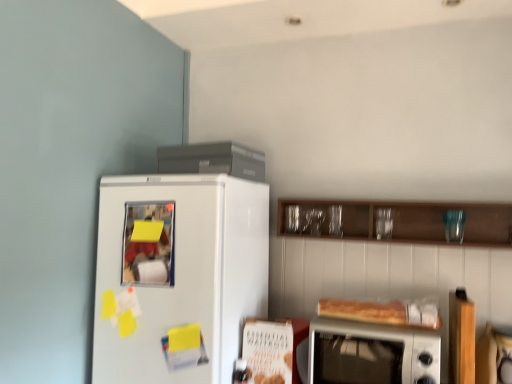
The height and width of the screenshot is (384, 512). I want to click on wooden cabinet at upper center, so pos(407,221).

Can you confirm if wooden cabinet at upper center is positioned to the left of white glossy refrigerator at left?

Incorrect, wooden cabinet at upper center is not on the left side of white glossy refrigerator at left.

Is wooden cabinet at upper center inside the boundaries of white glossy refrigerator at left, or outside?

The correct answer is: outside.

How different are the orientations of wooden cabinet at upper center and white glossy refrigerator at left in degrees?

The facing directions of wooden cabinet at upper center and white glossy refrigerator at left are 0.0741 degrees apart.

Which is behind, point (381, 208) or point (195, 242)?

The point (381, 208) is more distant.

Is wooden cabinet at upper center positioned before silver metallic microwave oven at lower right?

That is False.

Who is shorter, wooden cabinet at upper center or silver metallic microwave oven at lower right?

wooden cabinet at upper center.

Measure the distance between wooden cabinet at upper center and silver metallic microwave oven at lower right.

wooden cabinet at upper center is 21.29 inches from silver metallic microwave oven at lower right.

What are the coordinates of `appliance above the white glossy refrigerator at left (from the image's perspective)` in the screenshot? It's located at (213, 160).

Would you consider white glossy refrigerator at left to be distant from satin gray refrigerator at upper center?

No.

Does white glossy refrigerator at left contain satin gray refrigerator at upper center?

No, satin gray refrigerator at upper center is not a part of white glossy refrigerator at left.

From the image's perspective, is white glossy refrigerator at left beneath satin gray refrigerator at upper center?

Yes, from the image's perspective, white glossy refrigerator at left is beneath satin gray refrigerator at upper center.

How far apart are silver metallic microwave oven at lower right and satin gray refrigerator at upper center?

They are 79.35 centimeters apart.

Is silver metallic microwave oven at lower right in front of satin gray refrigerator at upper center?

That is True.

Which is in front, point (397, 382) or point (170, 166)?

Positioned in front is point (397, 382).

From a real-world perspective, does silver metallic microwave oven at lower right sit lower than satin gray refrigerator at upper center?

Yes, from a real-world perspective, silver metallic microwave oven at lower right is below satin gray refrigerator at upper center.

Who is bigger, silver metallic microwave oven at lower right or white glossy refrigerator at left?

white glossy refrigerator at left is bigger.

Is silver metallic microwave oven at lower right oriented towards white glossy refrigerator at left?

No, silver metallic microwave oven at lower right does not turn towards white glossy refrigerator at left.

From the image's perspective, is silver metallic microwave oven at lower right on white glossy refrigerator at left?

No.

Is silver metallic microwave oven at lower right inside or outside of wooden cabinet at upper center?

silver metallic microwave oven at lower right lies outside wooden cabinet at upper center.

From a real-world perspective, who is located higher, silver metallic microwave oven at lower right or wooden cabinet at upper center?

From a 3D spatial view, wooden cabinet at upper center is above.

What's the angular difference between silver metallic microwave oven at lower right and wooden cabinet at upper center's facing directions?

There is a 2.78-degree angle between the facing directions of silver metallic microwave oven at lower right and wooden cabinet at upper center.

Which object is further away from the camera, satin gray refrigerator at upper center or wooden cabinet at upper center?

satin gray refrigerator at upper center.

How many degrees apart are the facing directions of satin gray refrigerator at upper center and wooden cabinet at upper center?

They differ by 8.93 degrees in their facing directions.

Does point (164, 168) appear closer or farther from the camera than point (493, 218)?

Point (164, 168) is closer to the camera than point (493, 218).

From the image's perspective, does satin gray refrigerator at upper center appear lower than wooden cabinet at upper center?

No, from the image's perspective, satin gray refrigerator at upper center is not beneath wooden cabinet at upper center.

You are a GUI agent. You are given a task and a screenshot of the screen. Output one action in this format:
    pyautogui.click(x=<x>, y=<y>)
    Task: Click on the refrigerator below the wooden cabinet at upper center (from a real-world perspective)
    The width and height of the screenshot is (512, 384).
    Given the screenshot: What is the action you would take?
    pyautogui.click(x=182, y=273)

At what (x,y) coordinates should I click in order to perform the action: click on cabinetry that is on the right side of silver metallic microwave oven at lower right. Please return your answer as a coordinate pair (x, y). Looking at the image, I should click on (407, 221).

Considering their positions, is silver metallic microwave oven at lower right positioned closer to satin gray refrigerator at upper center than white glossy refrigerator at left?

The object closer to satin gray refrigerator at upper center is white glossy refrigerator at left.

Based on their spatial positions, is wooden cabinet at upper center or satin gray refrigerator at upper center closer to silver metallic microwave oven at lower right?

wooden cabinet at upper center is closer to silver metallic microwave oven at lower right.

Based on the photo, when comparing their distances from wooden cabinet at upper center, does satin gray refrigerator at upper center or white glossy refrigerator at left seem further?

Based on the image, white glossy refrigerator at left appears to be further to wooden cabinet at upper center.

When comparing their distances from satin gray refrigerator at upper center, does wooden cabinet at upper center or white glossy refrigerator at left seem closer?

Based on the image, white glossy refrigerator at left appears to be nearer to satin gray refrigerator at upper center.

When comparing their distances from satin gray refrigerator at upper center, does wooden cabinet at upper center or silver metallic microwave oven at lower right seem closer?

wooden cabinet at upper center.

From the image, which object appears to be nearer to silver metallic microwave oven at lower right, satin gray refrigerator at upper center or white glossy refrigerator at left?

white glossy refrigerator at left lies closer to silver metallic microwave oven at lower right than the other object.

From the image, which object appears to be nearer to wooden cabinet at upper center, silver metallic microwave oven at lower right or white glossy refrigerator at left?

silver metallic microwave oven at lower right lies closer to wooden cabinet at upper center than the other object.

Based on their spatial positions, is white glossy refrigerator at left or satin gray refrigerator at upper center further from silver metallic microwave oven at lower right?

satin gray refrigerator at upper center lies further to silver metallic microwave oven at lower right than the other object.

At what (x,y) coordinates should I click in order to perform the action: click on microwave oven located between white glossy refrigerator at left and wooden cabinet at upper center in the left-right direction. Please return your answer as a coordinate pair (x, y). Image resolution: width=512 pixels, height=384 pixels. Looking at the image, I should click on (371, 353).

I want to click on refrigerator between satin gray refrigerator at upper center and silver metallic microwave oven at lower right in the up-down direction, so click(182, 273).

The width and height of the screenshot is (512, 384). I want to click on appliance situated between white glossy refrigerator at left and wooden cabinet at upper center from left to right, so click(x=213, y=160).

What are the coordinates of `microwave oven situated between satin gray refrigerator at upper center and wooden cabinet at upper center from left to right` in the screenshot? It's located at pos(371,353).